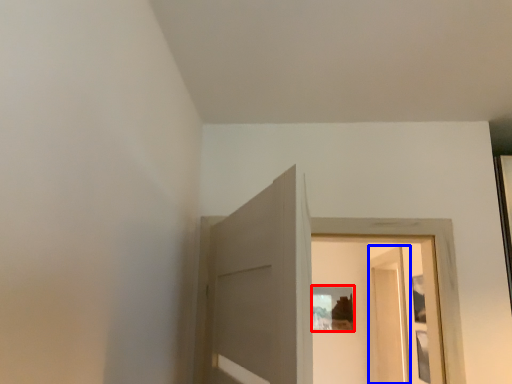
Question: Which of the following is the closest to the observer, picture frame (highlighted by a red box) or screen door (highlighted by a blue box)?

Choices:
 (A) picture frame
 (B) screen door

Answer: (B)